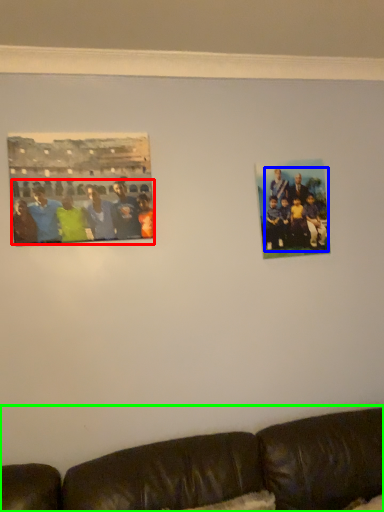
Question: Estimate the real-world distances between objects in this image. Which object is closer to person (highlighted by a red box), person (highlighted by a blue box) or studio couch (highlighted by a green box)?

Choices:
 (A) person
 (B) studio couch

Answer: (A)